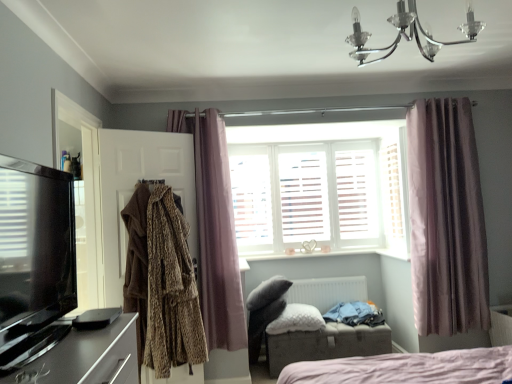
Question: Based on their sizes in the image, would you say brown textured coat at left, the 2th clothing when ordered from right to left, is bigger or smaller than black glossy speaker at lower left?

Choices:
 (A) big
 (B) small

Answer: (A)

Question: From the image's perspective, is brown textured coat at left, the 2th clothing when ordered from right to left, located above or below black glossy speaker at lower left?

Choices:
 (A) above
 (B) below

Answer: (B)

Question: Considering the real-world distances, which object is farthest from the black glossy tv at left?

Choices:
 (A) purple velvet curtain at left, the first curtain positioned from the left
 (B) gray fabric ottoman at lower center
 (C) white fluffy pillow at center
 (D) black glossy speaker at lower left
 (E) blue cotton shirt at lower right, acting as the first clothing starting from the bottom

Answer: (E)

Question: Which object is positioned farthest from the white matte radiator at center?

Choices:
 (A) purple velvet curtain at left, positioned as the 2th curtain in right-to-left order
 (B) white fluffy pillow at center
 (C) white wooden shutters at center
 (D) purple silky curtain at right, placed as the second curtain when sorted from left to right
 (E) chrome/crystal chandelier at upper center

Answer: (E)